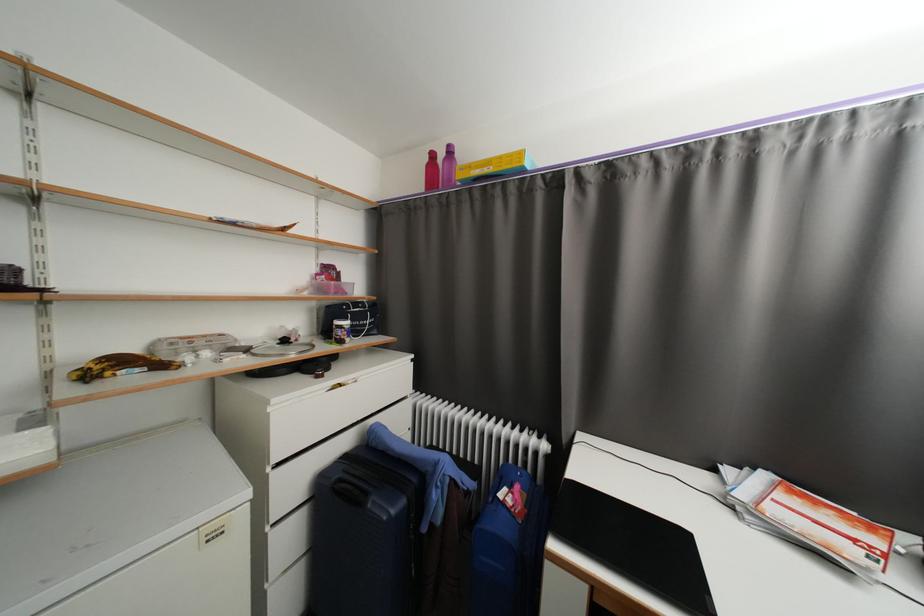
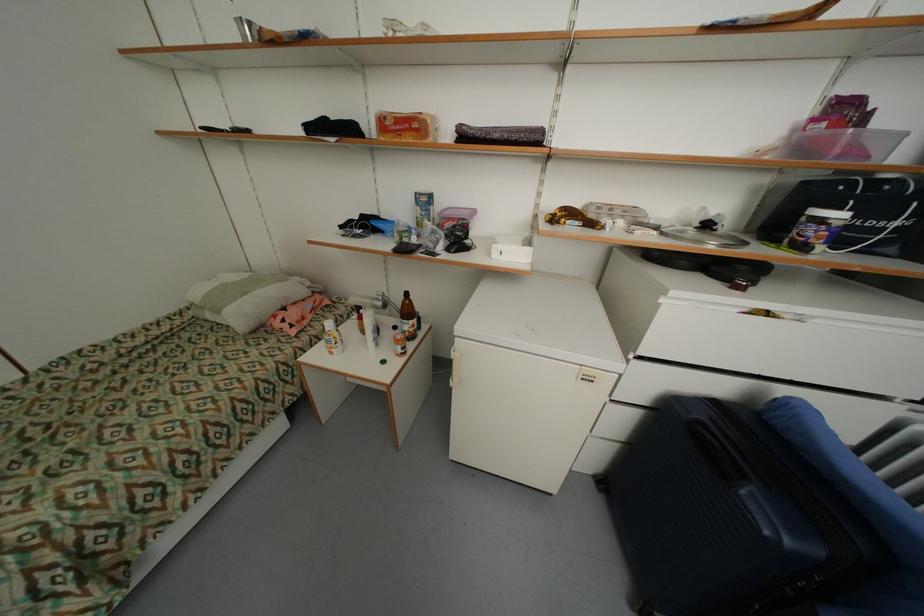
In the second image, find the point that corresponds to pixel 350 487 in the first image.

(715, 437)